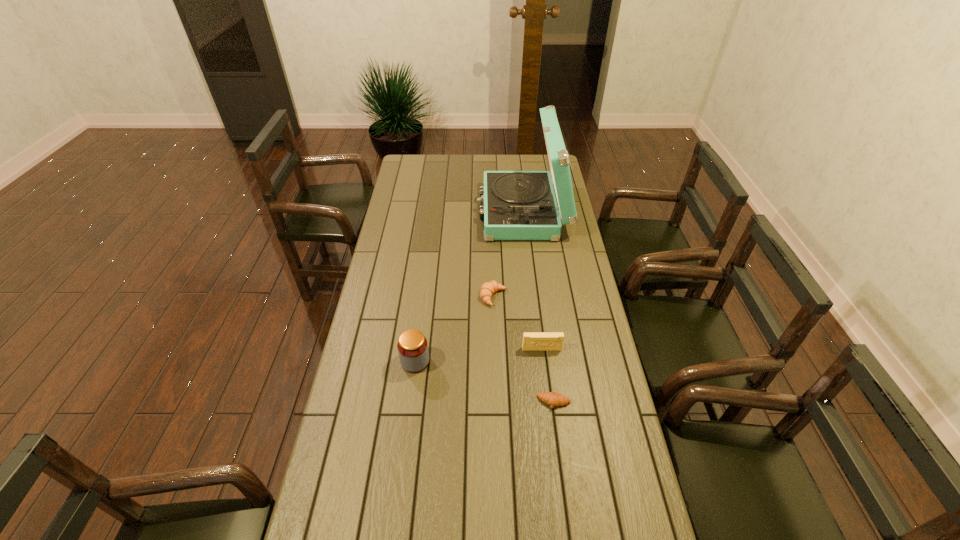
In the image, there is a desktop. Where is `vacant space at the far edge`? The image size is (960, 540). vacant space at the far edge is located at coordinates (459, 156).

Identify the location of free point at the left edge. (384, 232).

Image resolution: width=960 pixels, height=540 pixels. I want to click on vacant point at the right edge, so click(588, 358).

In the image, there is a desktop. Where is `vacant region at the far left corner`? This screenshot has height=540, width=960. vacant region at the far left corner is located at coordinates (427, 159).

The width and height of the screenshot is (960, 540). Find the location of `unoccupied area between the record player and the second tallest object`. unoccupied area between the record player and the second tallest object is located at coordinates (468, 287).

In order to click on free space that is in between the taller crescent roll and the tallest object in this screenshot , I will do `click(508, 254)`.

You are a GUI agent. You are given a task and a screenshot of the screen. Output one action in this format:
    pyautogui.click(x=<x>, y=<y>)
    Task: Click on the vacant area between the fourth tallest object and the videotape
    
    Given the screenshot: What is the action you would take?
    pyautogui.click(x=517, y=323)

Identify the location of free space between the record player and the jar. The width and height of the screenshot is (960, 540). (468, 287).

Locate an element on the screen. Image resolution: width=960 pixels, height=540 pixels. vacant space that is in between the videotape and the fourth tallest object is located at coordinates (517, 323).

Where is `unoccupied area between the second tallest object and the left crescent roll`? The height and width of the screenshot is (540, 960). unoccupied area between the second tallest object and the left crescent roll is located at coordinates (454, 329).